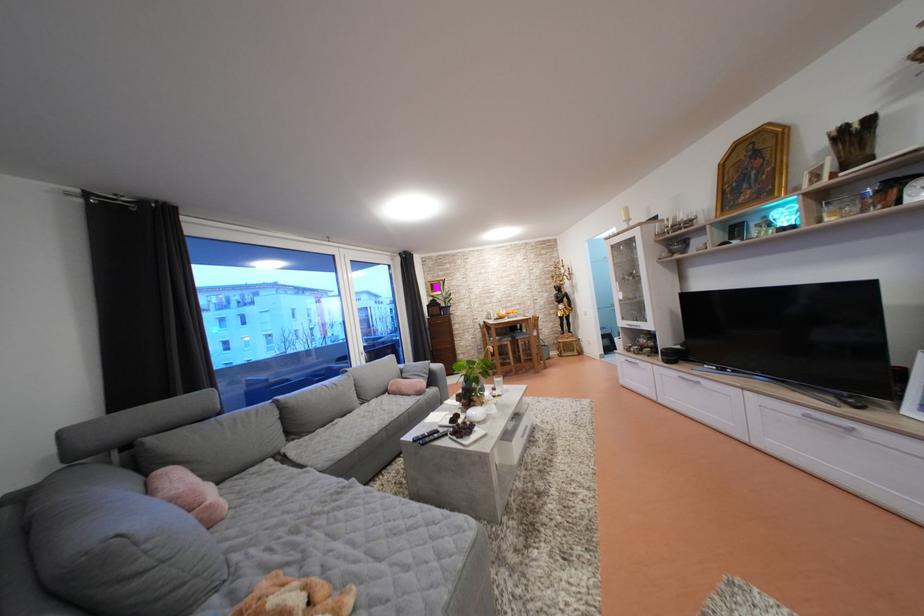
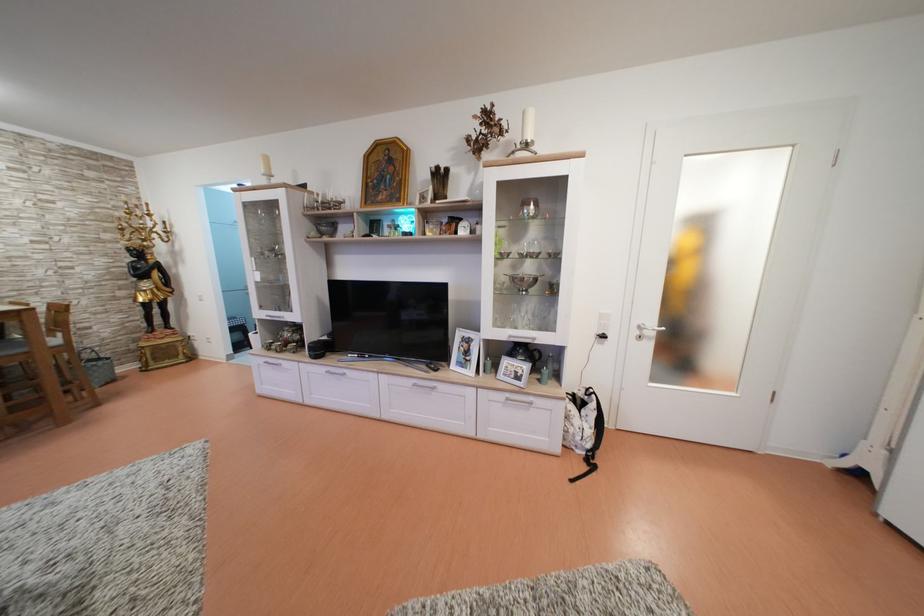
Where in the second image is the point corresponding to point (528, 334) from the first image?

(7, 339)